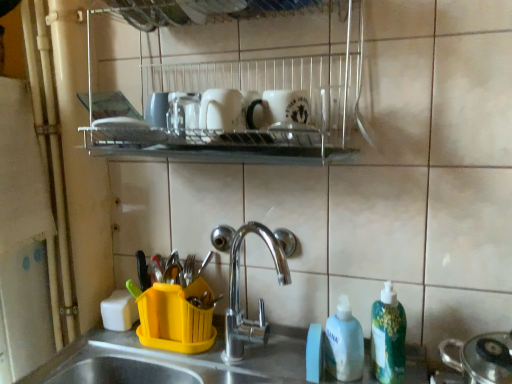
Question: From the image's perspective, is yellow plastic utensil holder at lower center located beneath metallic silver pot at lower right?

Choices:
 (A) yes
 (B) no

Answer: (A)

Question: Can metallic silver pot at lower right be found inside yellow plastic utensil holder at lower center?

Choices:
 (A) yes
 (B) no

Answer: (B)

Question: Considering the relative sizes of yellow plastic utensil holder at lower center and metallic silver pot at lower right in the image provided, is yellow plastic utensil holder at lower center bigger than metallic silver pot at lower right?

Choices:
 (A) yes
 (B) no

Answer: (A)

Question: Is yellow plastic utensil holder at lower center aimed at metallic silver pot at lower right?

Choices:
 (A) yes
 (B) no

Answer: (B)

Question: Does yellow plastic utensil holder at lower center have a lesser width compared to metallic silver pot at lower right?

Choices:
 (A) yes
 (B) no

Answer: (B)

Question: Does yellow plastic utensil holder at lower center have a lesser height compared to metallic silver pot at lower right?

Choices:
 (A) yes
 (B) no

Answer: (B)

Question: Could you tell me if green plastic bottle at lower right, the second cleaning product in the left-to-right sequence, is facing white matte bottle at lower right, which is the second cleaning product from right to left?

Choices:
 (A) yes
 (B) no

Answer: (B)

Question: From the image's perspective, is green plastic bottle at lower right, the second cleaning product in the left-to-right sequence, under white matte bottle at lower right, arranged as the first cleaning product when viewed from the left?

Choices:
 (A) no
 (B) yes

Answer: (A)

Question: Does green plastic bottle at lower right, which ranks as the first cleaning product in right-to-left order, have a greater height compared to white matte bottle at lower right, arranged as the first cleaning product when viewed from the left?

Choices:
 (A) yes
 (B) no

Answer: (A)

Question: Considering the relative sizes of green plastic bottle at lower right, which ranks as the first cleaning product in right-to-left order, and white matte bottle at lower right, which is the second cleaning product from right to left, in the image provided, is green plastic bottle at lower right, which ranks as the first cleaning product in right-to-left order, smaller than white matte bottle at lower right, which is the second cleaning product from right to left,?

Choices:
 (A) yes
 (B) no

Answer: (B)

Question: Would you say white matte bottle at lower right, arranged as the first cleaning product when viewed from the left, is part of green plastic bottle at lower right, which ranks as the first cleaning product in right-to-left order,'s contents?

Choices:
 (A) no
 (B) yes

Answer: (A)

Question: Does green plastic bottle at lower right, the second cleaning product in the left-to-right sequence, have a lesser height compared to white matte bottle at lower right, arranged as the first cleaning product when viewed from the left?

Choices:
 (A) no
 (B) yes

Answer: (A)

Question: Considering the relative sizes of green plastic bottle at lower right, the second cleaning product in the left-to-right sequence, and metallic silver pot at lower right in the image provided, is green plastic bottle at lower right, the second cleaning product in the left-to-right sequence, thinner than metallic silver pot at lower right?

Choices:
 (A) no
 (B) yes

Answer: (B)